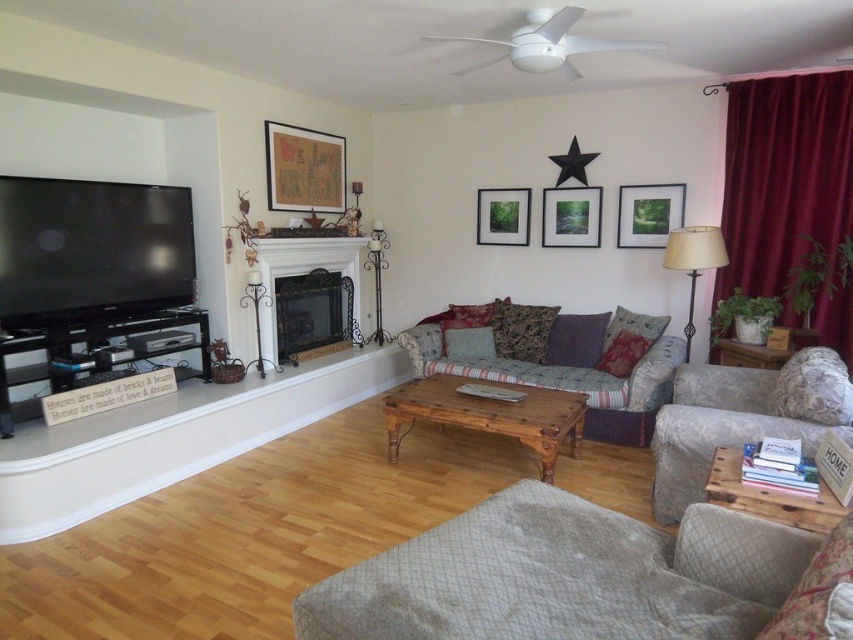
Between point (706, 545) and point (410, 332), which one is positioned behind?

Positioned behind is point (410, 332).

The height and width of the screenshot is (640, 853). What do you see at coordinates (589, 577) in the screenshot?
I see `gray fabric ottoman at lower center` at bounding box center [589, 577].

Identify the location of gray fabric ottoman at lower center. (589, 577).

From the picture: Which is below, gray fabric ottoman at lower center or floral fabric armchair at right?

gray fabric ottoman at lower center is below.

Between point (354, 580) and point (688, 456), which one is positioned in front?

Point (354, 580)

Does point (410, 595) lie behind point (689, 376)?

No, (410, 595) is closer to viewer.

This screenshot has width=853, height=640. In order to click on gray fabric ottoman at lower center in this screenshot , I will do `click(589, 577)`.

From the picture: Is black wrought iron fireplace at center above matte green picture frame at upper right?

Actually, black wrought iron fireplace at center is below matte green picture frame at upper right.

Is black wrought iron fireplace at center positioned before matte green picture frame at upper right?

That is True.

Is point (273, 355) positioned before point (637, 224)?

Yes, point (273, 355) is closer to viewer.

Where is `black wrought iron fireplace at center`? Image resolution: width=853 pixels, height=640 pixels. black wrought iron fireplace at center is located at coordinates (300, 273).